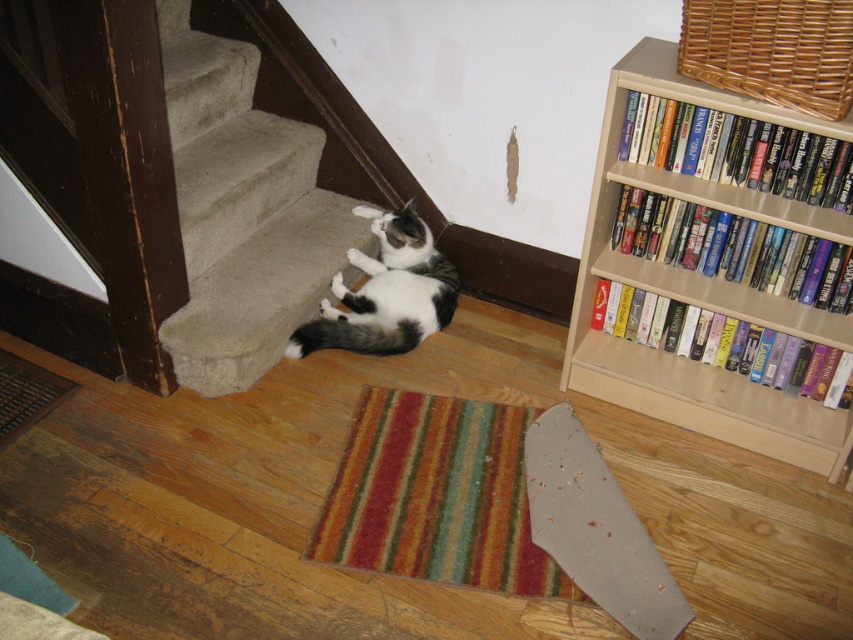
Question: From the image, what is the correct spatial relationship of carpeted stairs at lower left in relation to black and white fur cat at lower center?

Choices:
 (A) above
 (B) below

Answer: (A)

Question: Estimate the real-world distances between objects in this image. Which object is closer to the black and white fur cat at lower center?

Choices:
 (A) carpeted stairs at lower left
 (B) beige wood bookcase at upper right

Answer: (A)

Question: Among these objects, which one is farthest from the camera?

Choices:
 (A) carpeted stairs at lower left
 (B) beige wood bookcase at upper right
 (C) black and white fur cat at lower center

Answer: (C)

Question: Does carpeted stairs at lower left appear on the right side of beige wood bookcase at upper right?

Choices:
 (A) no
 (B) yes

Answer: (A)

Question: Among these objects, which one is nearest to the camera?

Choices:
 (A) black and white fur cat at lower center
 (B) beige wood bookcase at upper right

Answer: (B)

Question: In this image, where is beige wood bookcase at upper right located relative to black and white fur cat at lower center?

Choices:
 (A) left
 (B) right

Answer: (B)